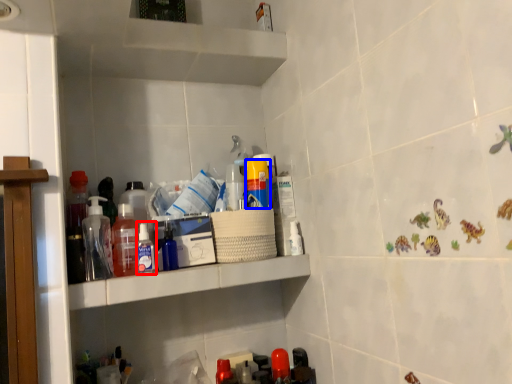
Question: Which object is further to the camera taking this photo, toiletry (highlighted by a red box) or toiletry (highlighted by a blue box)?

Choices:
 (A) toiletry
 (B) toiletry

Answer: (B)